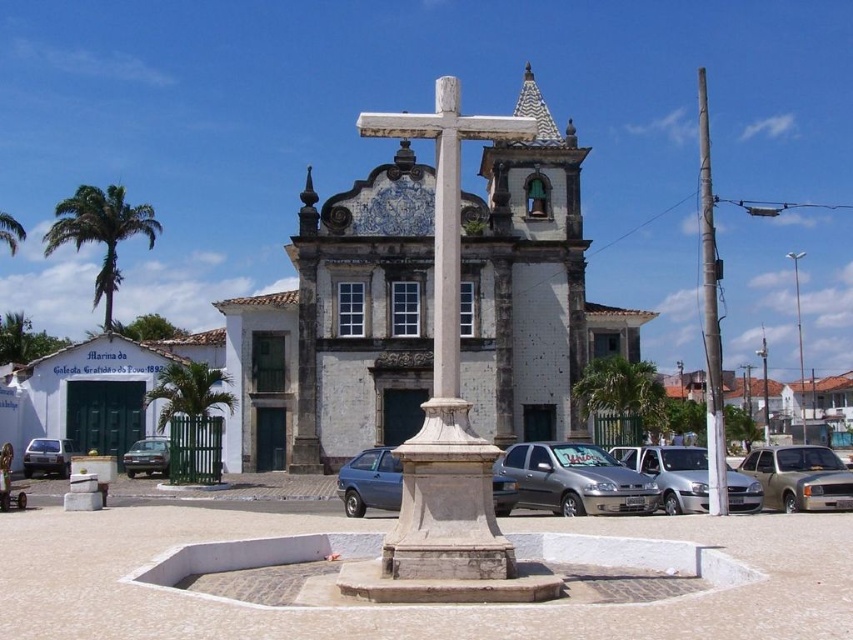
You are a tourist standing in front of the historical building. You notice a green leafy palm tree at upper center and a brown metallic car at lower left. Which object is larger in size?

The green leafy palm tree at upper center is bigger than the brown metallic car at lower left according to the description.

You are standing in front of the historical building and want to take a photo that includes both point (437, 276) and point (189, 378). Since you want the closer point to be in focus, which point should you focus on?

Point (437, 276) is closer to the camera than point (189, 378), so you should focus on point (437, 276) to ensure it is in focus.